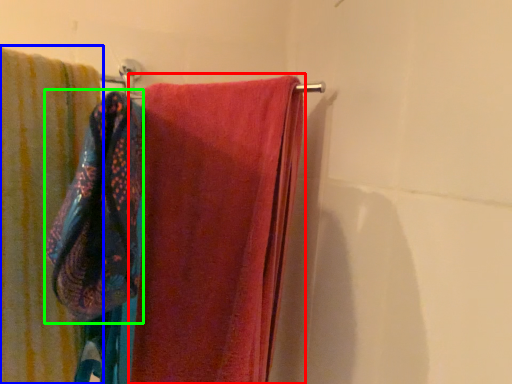
Question: Estimate the real-world distances between objects in this image. Which object is farther from towel (highlighted by a red box), towel (highlighted by a blue box) or beach towel (highlighted by a green box)?

Choices:
 (A) towel
 (B) beach towel

Answer: (B)